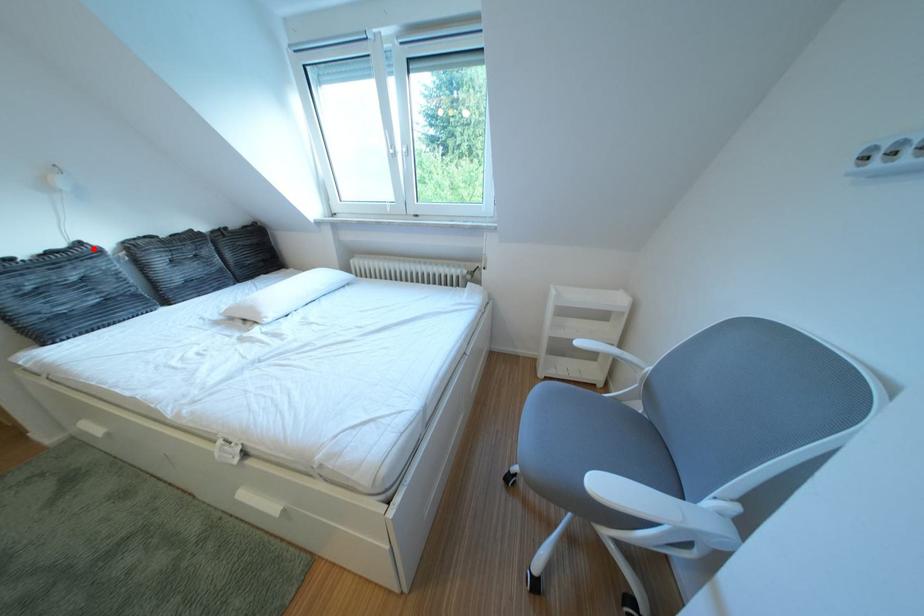
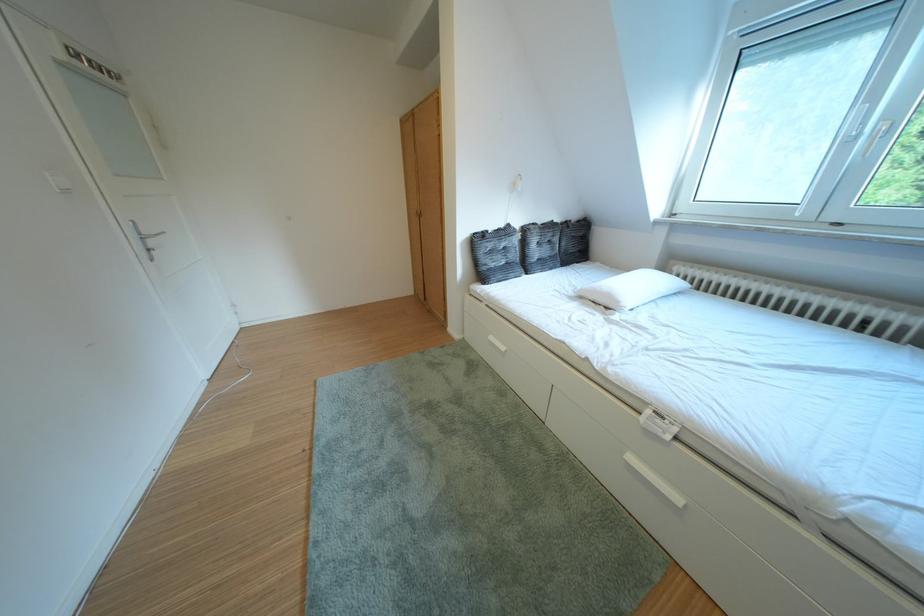
Locate, in the second image, the point that corresponds to the highlighted location in the first image.

(523, 230)